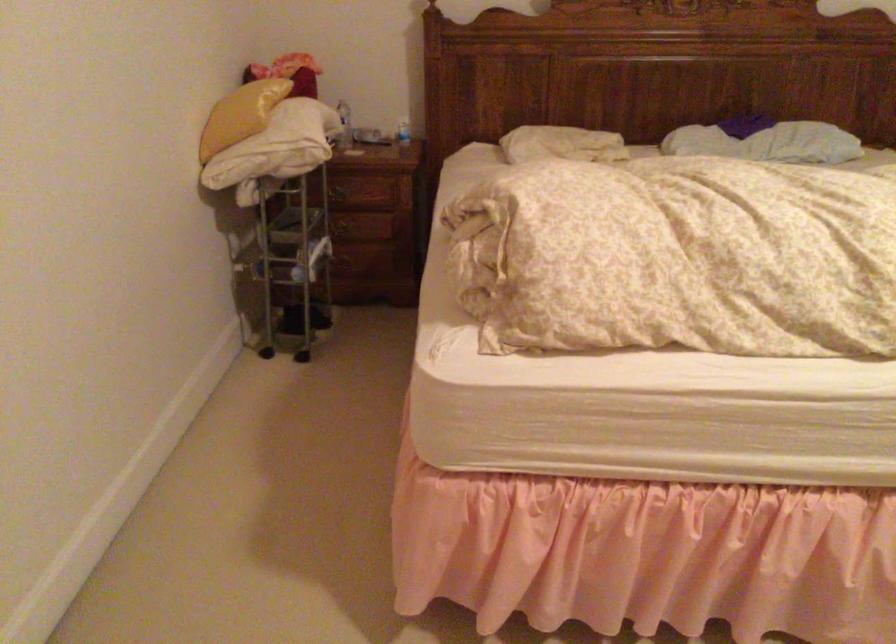
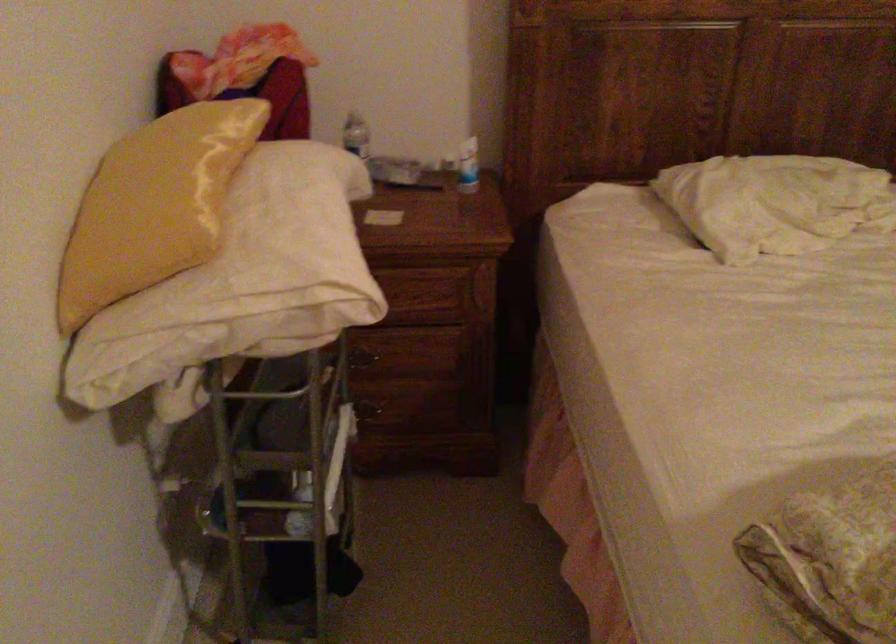
Find the pixel in the second image that matches (x=280, y=135) in the first image.

(254, 272)